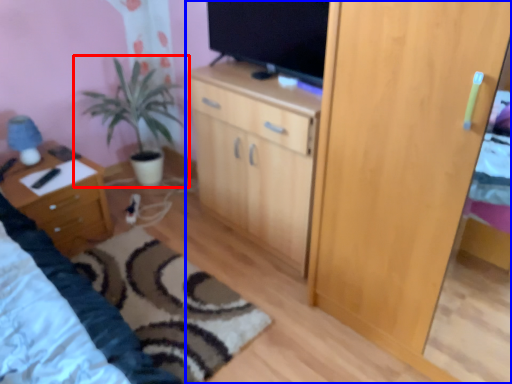
Question: Among these objects, which one is nearest to the camera, houseplant (highlighted by a red box) or cupboard (highlighted by a blue box)?

Choices:
 (A) houseplant
 (B) cupboard

Answer: (B)